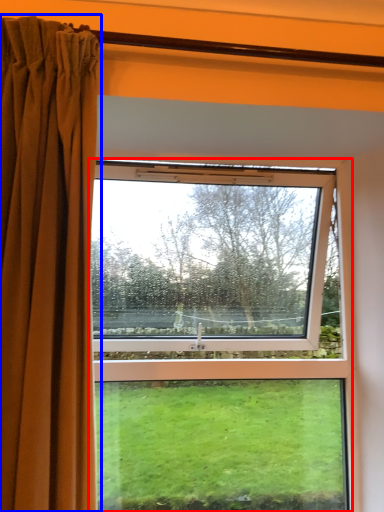
Question: Which point is closer to the camera, window (highlighted by a red box) or curtain (highlighted by a blue box)?

Choices:
 (A) window
 (B) curtain

Answer: (B)